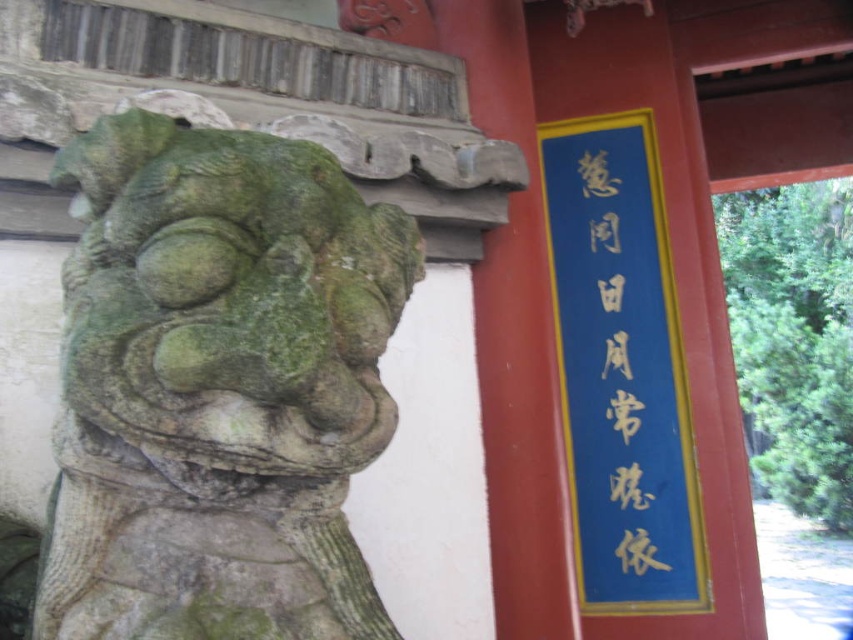
You are a photographer standing at a certain distance from the green stone lion at left. You want to capture a closeup shot of the lion without any distortion. What is the minimum distance you should maintain from the lion?

The minimum distance you should maintain from the green stone lion at left is approximately 30.58 inches to avoid distortion in the closeup shot.

You are a tour guide explaining the historical site to visitors. You want to point out the green stone lion at left and the blue paper sign at upper right. Which object is positioned to the left of the other?

The green stone lion at left is positioned to the left of the blue paper sign at upper right.